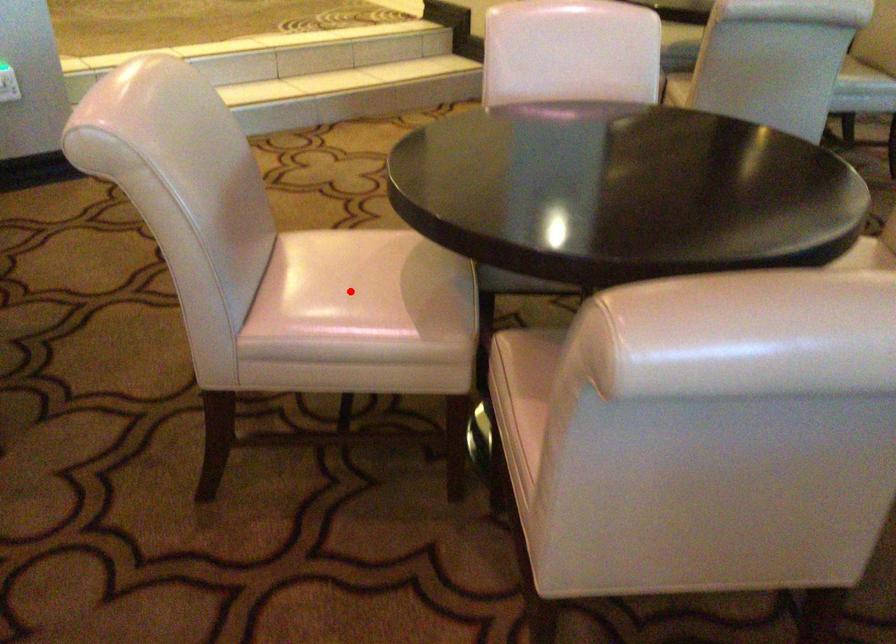
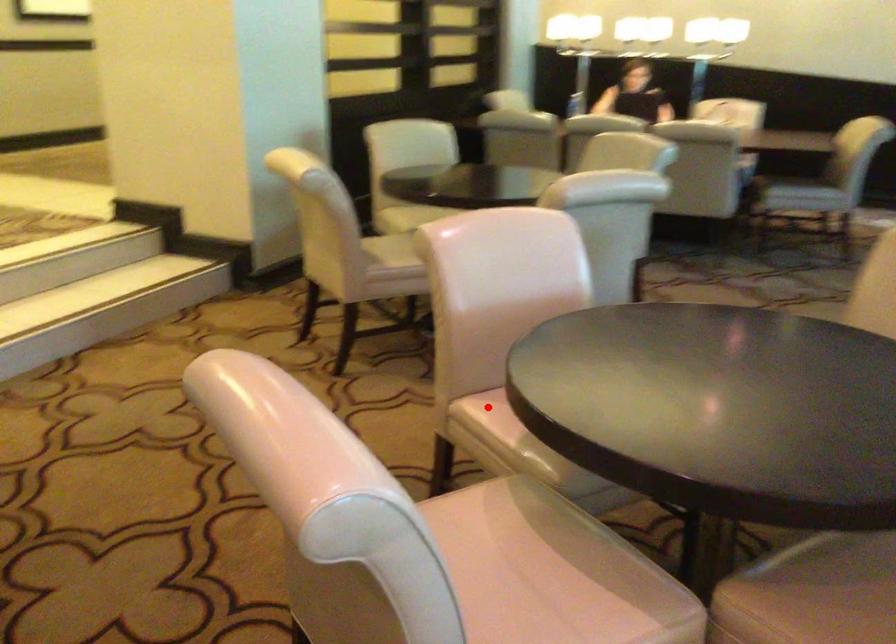
I am providing you with two images of the same scene from different viewpoints. A red point is marked on the first image and another point is marked on the second image. Does the point marked in image1 correspond to the same location as the one in image2?

No